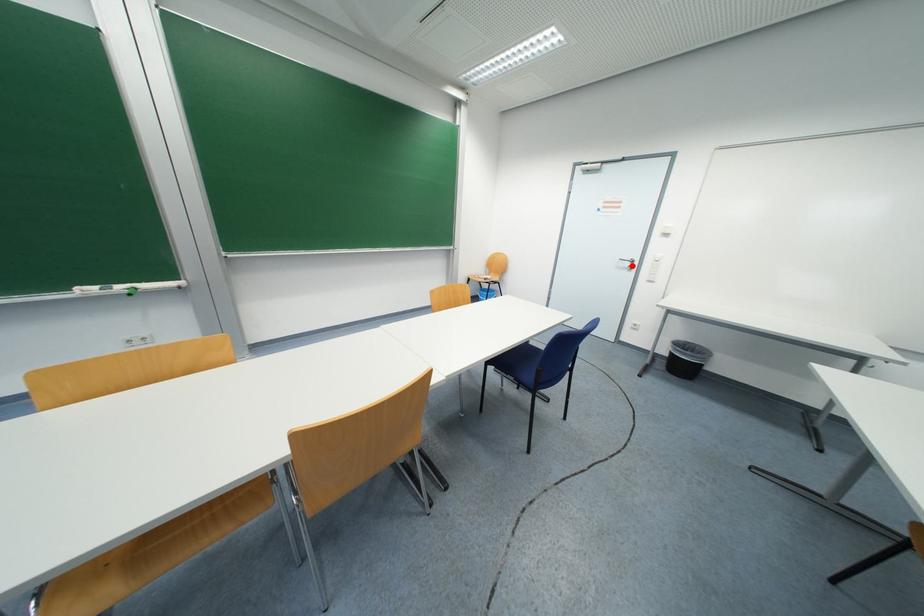
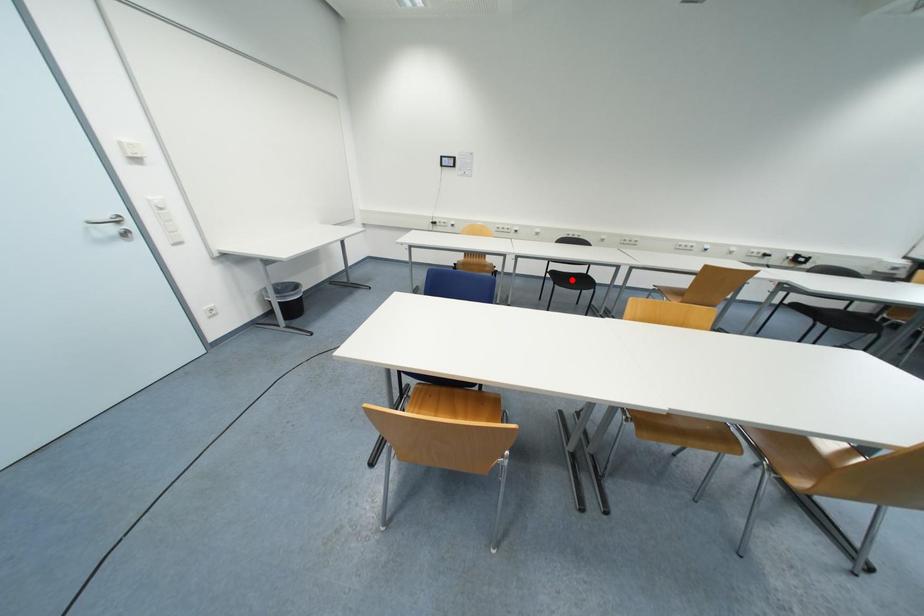
I am providing you with two images of the same scene from different viewpoints. A red point is marked on the first image and another point is marked on the second image. Do the highlighted points in image1 and image2 indicate the same real-world spot?

No